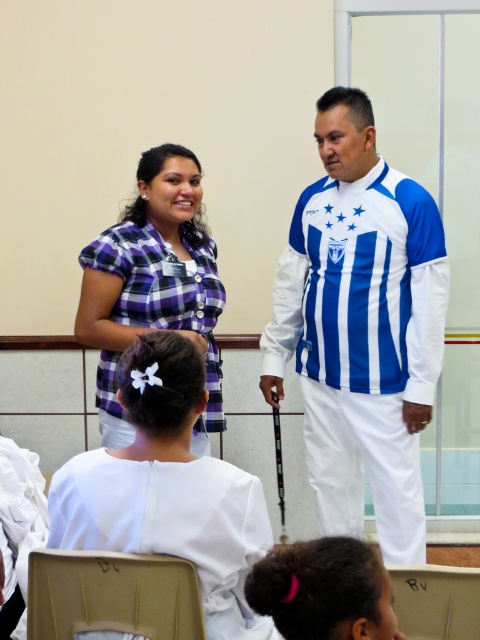
Between purple checkered shirt at center and white plastic chair at lower center, which one appears on the right side from the viewer's perspective?

From the viewer's perspective, white plastic chair at lower center appears more on the right side.

Locate an element on the screen. Image resolution: width=480 pixels, height=640 pixels. purple checkered shirt at center is located at coordinates (153, 284).

Is point (181, 198) positioned in front of point (472, 595)?

No, it is behind (472, 595).

Locate an element on the screen. This screenshot has width=480, height=640. purple checkered shirt at center is located at coordinates [153, 284].

Looking at this image, can you confirm if blue and white striped jersey at center is positioned to the left of beige fabric chair at lower left?

In fact, blue and white striped jersey at center is to the right of beige fabric chair at lower left.

Which of these two, blue and white striped jersey at center or beige fabric chair at lower left, stands shorter?

beige fabric chair at lower left is shorter.

Who is more distant from viewer, [368,205] or [83,563]?

Positioned behind is point [368,205].

I want to click on blue and white striped jersey at center, so click(360, 326).

Is white satin blouse at center bigger than white plastic chair at lower center?

Yes.

Is white satin blouse at center thinner than white plastic chair at lower center?

No, white satin blouse at center is not thinner than white plastic chair at lower center.

This screenshot has height=640, width=480. I want to click on white satin blouse at center, so click(x=168, y=488).